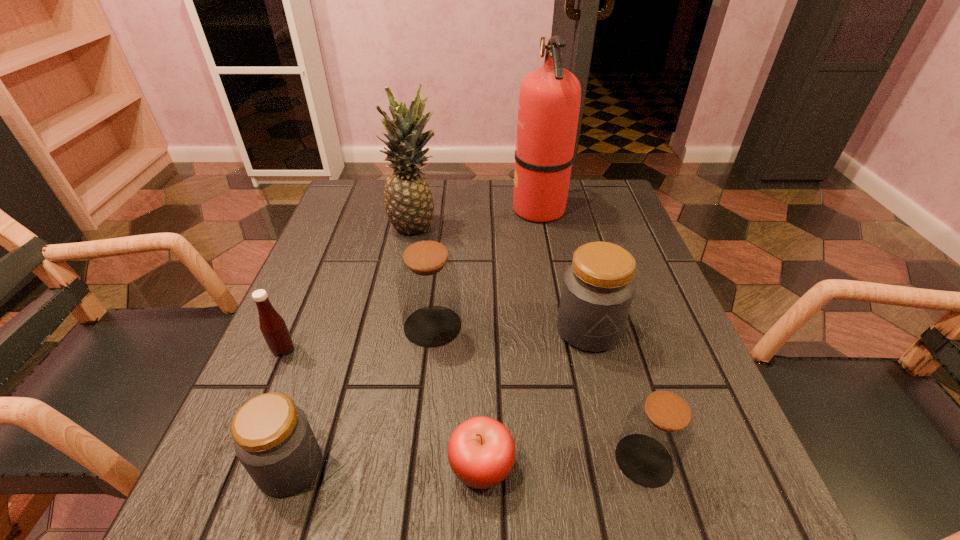
Identify the location of red fire extinguisher. The height and width of the screenshot is (540, 960). (549, 102).

Find the location of `the tallest object`. the tallest object is located at coordinates (549, 102).

The image size is (960, 540). In order to click on pineapple in this screenshot , I will do `click(409, 205)`.

You are a GUI agent. You are given a task and a screenshot of the screen. Output one action in this format:
    pyautogui.click(x=<x>, y=<y>)
    Task: Click on the green pineapple
    This screenshot has height=540, width=960.
    Given the screenshot: What is the action you would take?
    pyautogui.click(x=409, y=205)

At what (x,y) coordinates should I click in order to perform the action: click on the farther brown jar. Please return your answer as a coordinate pair (x, y). The height and width of the screenshot is (540, 960). Looking at the image, I should click on (428, 283).

Identify the location of the bigger brown jar. This screenshot has width=960, height=540. (428, 283).

The height and width of the screenshot is (540, 960). Identify the location of the right gray jar. (598, 288).

Find the location of a particular element. The width and height of the screenshot is (960, 540). the farther gray jar is located at coordinates (598, 288).

In order to click on the leftmost object in this screenshot , I will do `click(273, 327)`.

Find the location of a particular element. Tabasco sauce is located at coordinates (273, 327).